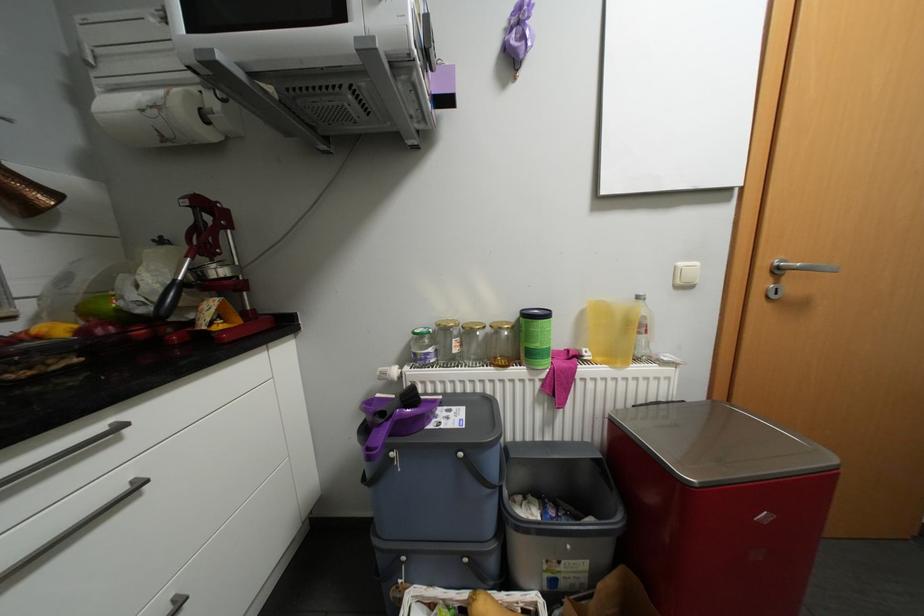
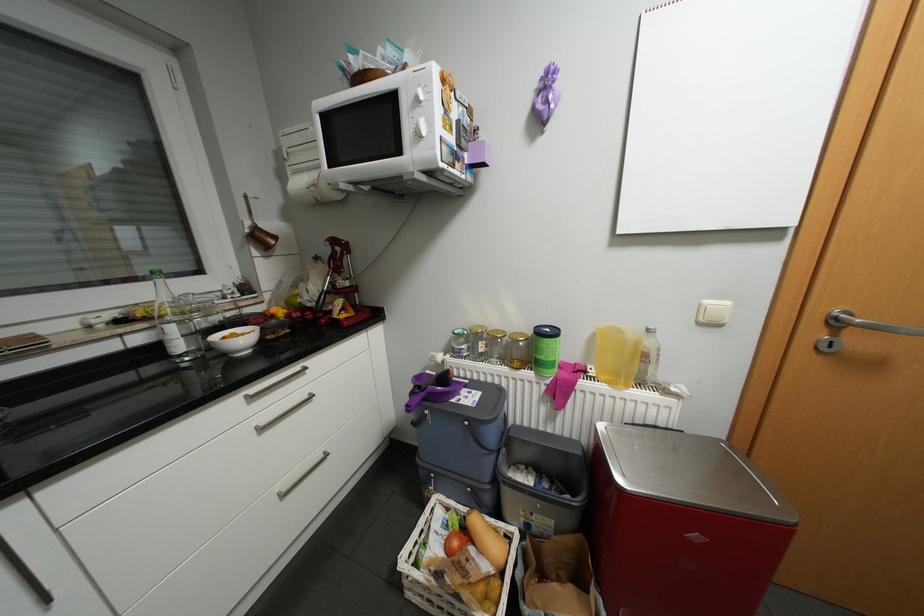
Find the pixel in the second image that matches (x=402, y=416) in the first image.

(441, 389)